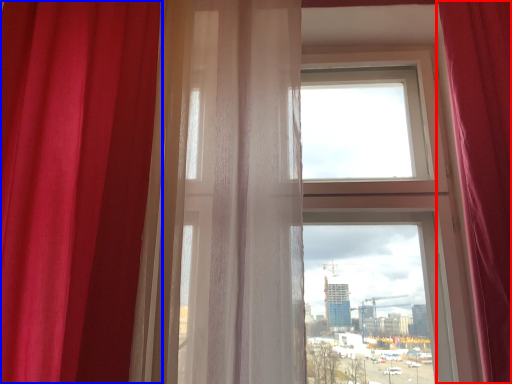
Question: Which object appears farthest to the camera in this image, curtain (highlighted by a red box) or curtain (highlighted by a blue box)?

Choices:
 (A) curtain
 (B) curtain

Answer: (B)